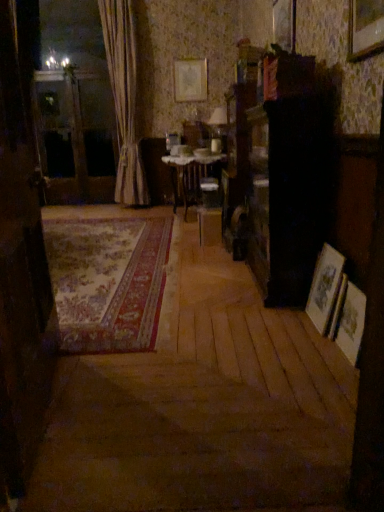
Question: Considering the relative sizes of matte gold picture frame at upper center, the first picture frame in the top-to-bottom sequence, and transparent glass screen door at left, which appears as the first screen door when viewed from the top, in the image provided, is matte gold picture frame at upper center, the first picture frame in the top-to-bottom sequence, thinner than transparent glass screen door at left, which appears as the first screen door when viewed from the top,?

Choices:
 (A) no
 (B) yes

Answer: (B)

Question: Can you confirm if matte gold picture frame at upper center, the fourth picture frame from the bottom, is taller than transparent glass screen door at left, marked as the second screen door in a front-to-back arrangement?

Choices:
 (A) yes
 (B) no

Answer: (B)

Question: Is matte gold picture frame at upper center, which is counted as the 4th picture frame, starting from the front, at the right side of transparent glass screen door at left, which is counted as the second screen door, starting from the right?

Choices:
 (A) no
 (B) yes

Answer: (B)

Question: Considering the relative sizes of matte gold picture frame at upper center, the fourth picture frame from the bottom, and transparent glass screen door at left, which is counted as the second screen door, starting from the right, in the image provided, is matte gold picture frame at upper center, the fourth picture frame from the bottom, wider than transparent glass screen door at left, which is counted as the second screen door, starting from the right,?

Choices:
 (A) yes
 (B) no

Answer: (B)

Question: From a real-world perspective, is matte gold picture frame at upper center, acting as the first picture frame starting from the left, over transparent glass screen door at left, placed as the second screen door when sorted from bottom to top?

Choices:
 (A) no
 (B) yes

Answer: (B)

Question: From a real-world perspective, is transparent glass screen door at left, the second screen door viewed from the back, physically located above or below carpeted rug at center?

Choices:
 (A) below
 (B) above

Answer: (B)

Question: Do you think transparent glass screen door at left, placed as the second screen door when sorted from top to bottom, is within carpeted rug at center, or outside of it?

Choices:
 (A) inside
 (B) outside

Answer: (B)

Question: Does point (13, 399) appear closer or farther from the camera than point (82, 314)?

Choices:
 (A) closer
 (B) farther

Answer: (A)

Question: Visually, is transparent glass screen door at left, arranged as the 1th screen door when ordered from the bottom, positioned to the left or to the right of carpeted rug at center?

Choices:
 (A) left
 (B) right

Answer: (B)

Question: Considering the relative positions of wooden picture frame at upper center, which appears as the third picture frame when ordered from the bottom, and matte gold picture frame at upper center, which is counted as the 4th picture frame, starting from the front, in the image provided, is wooden picture frame at upper center, which appears as the third picture frame when ordered from the bottom, to the left or to the right of matte gold picture frame at upper center, which is counted as the 4th picture frame, starting from the front,?

Choices:
 (A) right
 (B) left

Answer: (A)

Question: From the image's perspective, relative to matte gold picture frame at upper center, the fourth picture frame from the bottom, is wooden picture frame at upper center, which appears as the third picture frame when ordered from the bottom, above or below?

Choices:
 (A) below
 (B) above

Answer: (A)

Question: In terms of size, does wooden picture frame at upper center, positioned as the 2th picture frame in top-to-bottom order, appear bigger or smaller than matte gold picture frame at upper center, acting as the first picture frame starting from the left?

Choices:
 (A) small
 (B) big

Answer: (B)

Question: Relative to matte gold picture frame at upper center, the first picture frame in the top-to-bottom sequence, is wooden picture frame at upper center, marked as the 2th picture frame in a right-to-left arrangement, in front or behind?

Choices:
 (A) front
 (B) behind

Answer: (A)

Question: Considering the positions of wooden picture frame at right, the second picture frame from the front, and wooden picture frame at lower right, marked as the fourth picture frame in a top-to-bottom arrangement, in the image, is wooden picture frame at right, the second picture frame from the front, wider or thinner than wooden picture frame at lower right, marked as the fourth picture frame in a top-to-bottom arrangement,?

Choices:
 (A) wide
 (B) thin

Answer: (A)

Question: Does point (322, 262) appear closer or farther from the camera than point (339, 348)?

Choices:
 (A) farther
 (B) closer

Answer: (A)